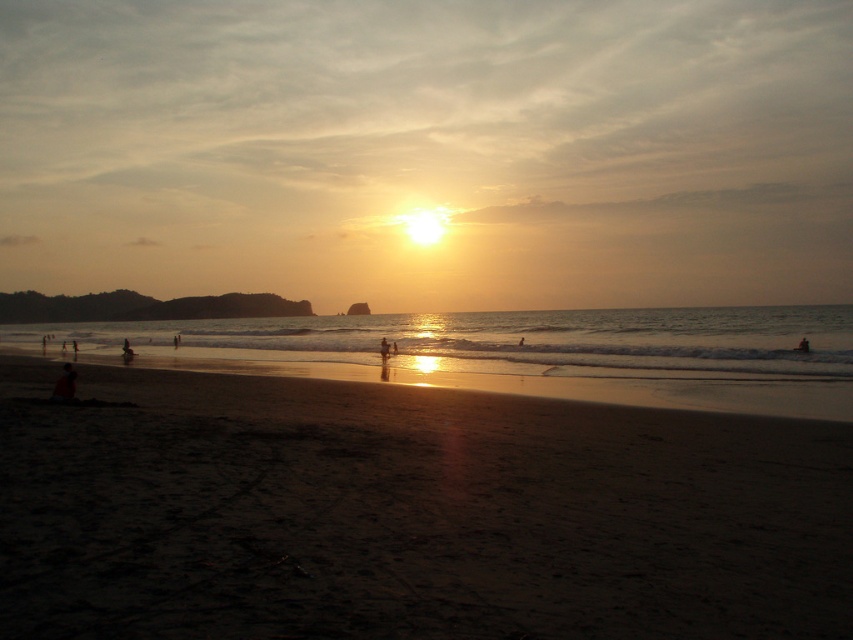
Is shiny metallic water at center thinner than silhouette human at lower right?

No.

Is point (805, 360) positioned before point (796, 348)?

Yes, point (805, 360) is closer to viewer.

In order to click on shiny metallic water at center in this screenshot , I will do `click(519, 353)`.

Can you confirm if matte black person at lower left is smaller than silhouette sand at center?

Incorrect, matte black person at lower left is not smaller in size than silhouette sand at center.

Is matte black person at lower left positioned before silhouette sand at center?

Yes.

Which is behind, point (61, 392) or point (386, 355)?

Positioned behind is point (386, 355).

You are a GUI agent. You are given a task and a screenshot of the screen. Output one action in this format:
    pyautogui.click(x=<x>, y=<y>)
    Task: Click on the matte black person at lower left
    Image resolution: width=853 pixels, height=640 pixels.
    Given the screenshot: What is the action you would take?
    pyautogui.click(x=65, y=384)

Can you confirm if dark sand at lower center is positioned below dark skin human at center?

Actually, dark sand at lower center is above dark skin human at center.

In the scene shown: Between dark sand at lower center and dark skin human at center, which one appears on the right side from the viewer's perspective?

dark sand at lower center is more to the right.

Image resolution: width=853 pixels, height=640 pixels. Identify the location of dark sand at lower center. (407, 513).